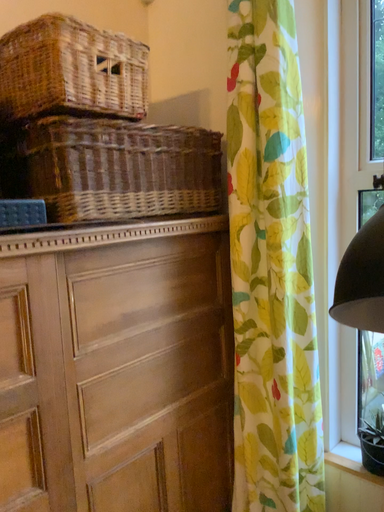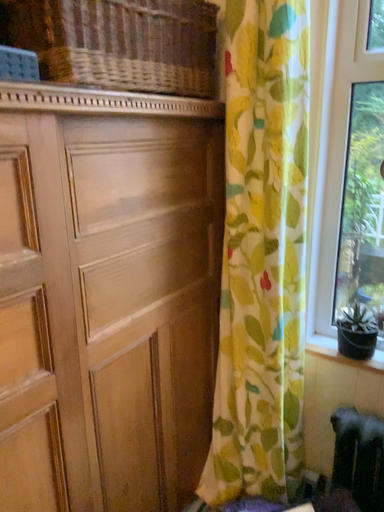
Question: Which way did the camera rotate in the video?

Choices:
 (A) rotated left
 (B) rotated right

Answer: (B)